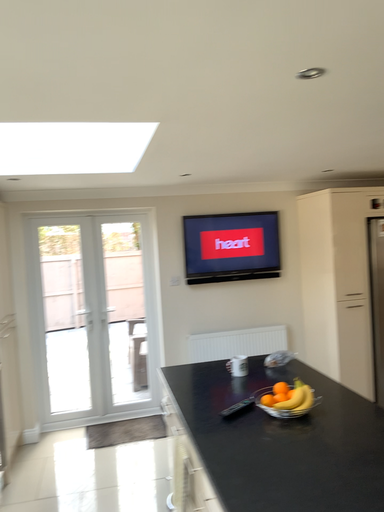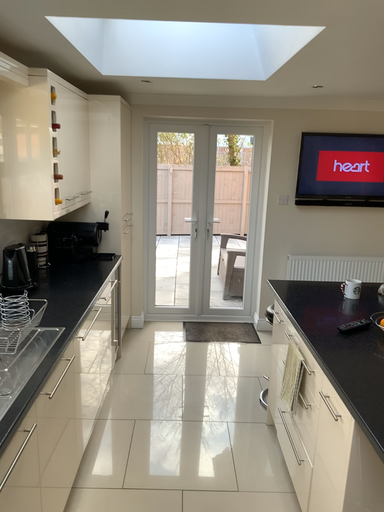
Question: How did the camera likely rotate when shooting the video?

Choices:
 (A) rotated upward
 (B) rotated downward

Answer: (B)